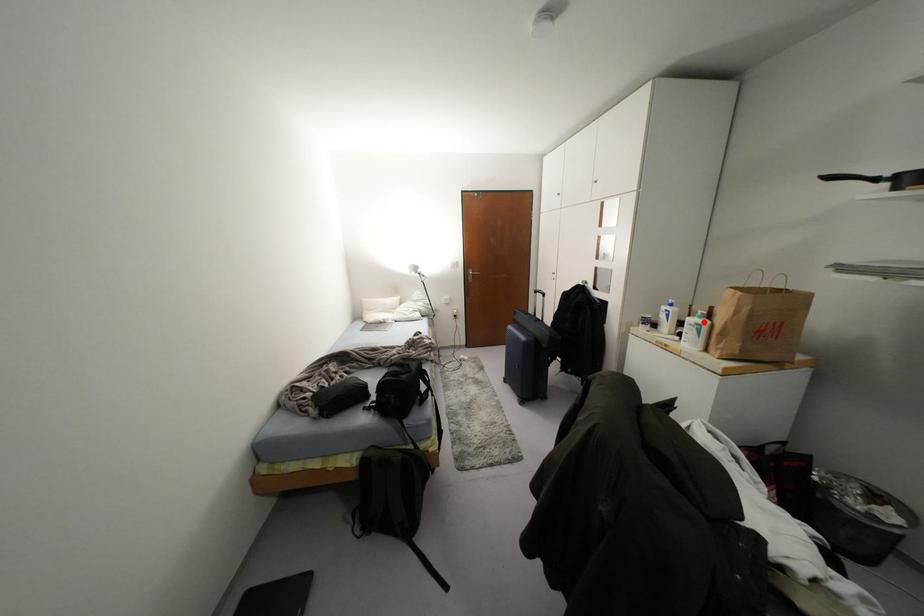
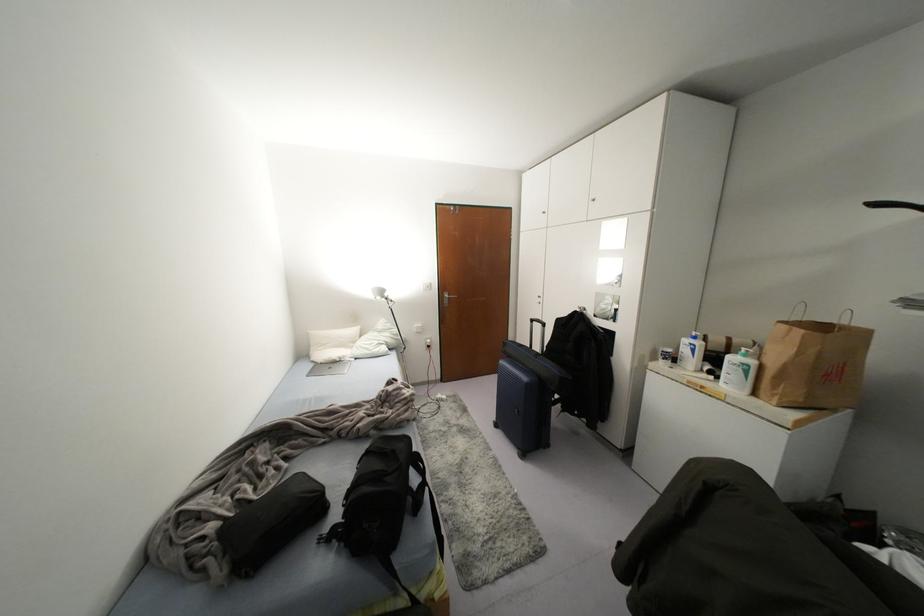
Question: I am providing you with two images of the same scene from different viewpoints. Given a red point in image1, look at the same physical point in image2. Is it:

Choices:
 (A) Closer to the viewpoint
 (B) Farther from the viewpoint

Answer: (B)